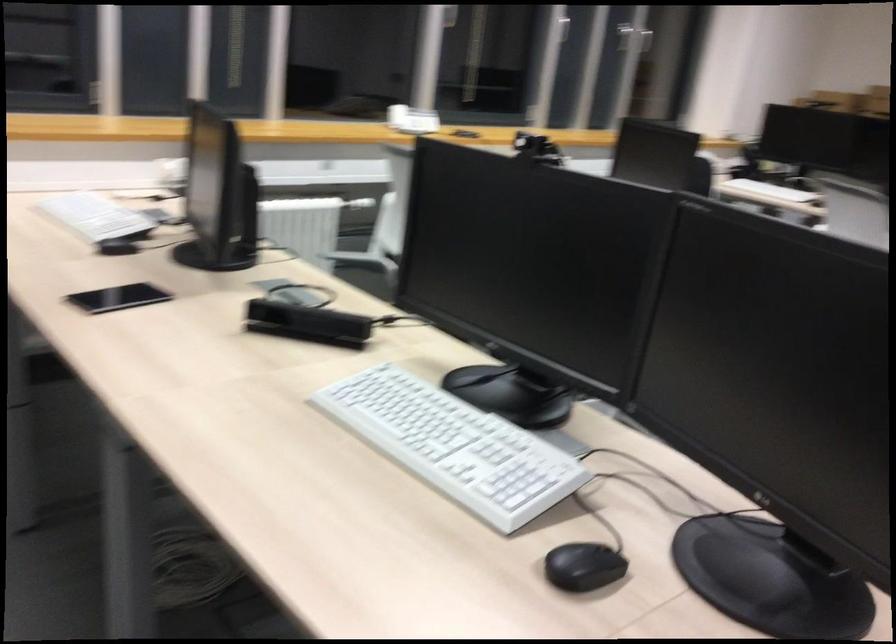
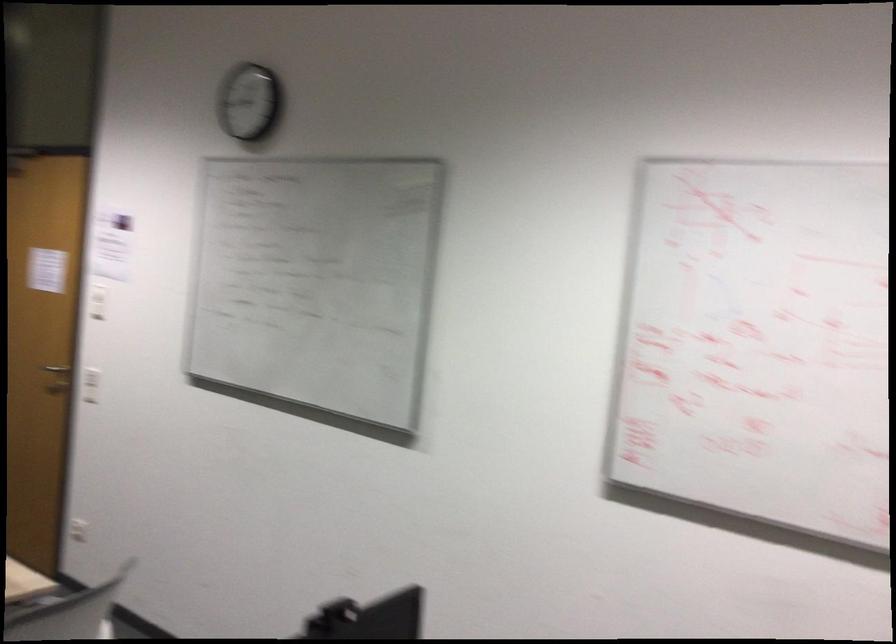
Question: Based on the continuous images, in which direction is the camera rotating? Reply with the corresponding letter.

Choices:
 (A) Left
 (B) Right
 (C) Up
 (D) Down

Answer: (B)